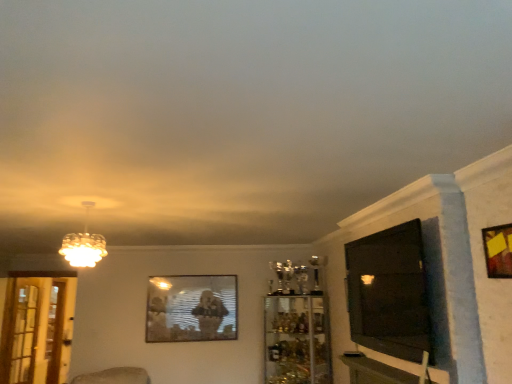
Question: Would you say wooden frame at upper right, the second picture frame in the bottom-to-top sequence, contains matte glass chandelier at upper left?

Choices:
 (A) no
 (B) yes

Answer: (A)

Question: Does wooden frame at upper right, the first picture frame from the top, touch matte glass chandelier at upper left?

Choices:
 (A) yes
 (B) no

Answer: (B)

Question: From a real-world perspective, is wooden frame at upper right, arranged as the first picture frame when viewed from the right, located higher than matte glass chandelier at upper left?

Choices:
 (A) yes
 (B) no

Answer: (B)

Question: Considering the relative sizes of wooden frame at upper right, arranged as the second picture frame when viewed from the back, and matte glass chandelier at upper left in the image provided, is wooden frame at upper right, arranged as the second picture frame when viewed from the back, thinner than matte glass chandelier at upper left?

Choices:
 (A) no
 (B) yes

Answer: (B)

Question: Can you confirm if wooden frame at upper right, which is counted as the second picture frame, starting from the left, is positioned to the left of matte glass chandelier at upper left?

Choices:
 (A) no
 (B) yes

Answer: (A)

Question: Considering the relative positions of wooden frame at upper right, the second picture frame in the bottom-to-top sequence, and matte glass chandelier at upper left in the image provided, is wooden frame at upper right, the second picture frame in the bottom-to-top sequence, behind matte glass chandelier at upper left?

Choices:
 (A) no
 (B) yes

Answer: (A)

Question: Can you confirm if wooden table at lower right is smaller than black glossy tv at right?

Choices:
 (A) no
 (B) yes

Answer: (B)

Question: Considering the relative sizes of wooden table at lower right and black glossy tv at right in the image provided, is wooden table at lower right taller than black glossy tv at right?

Choices:
 (A) yes
 (B) no

Answer: (B)

Question: Is wooden table at lower right to the left of black glossy tv at right from the viewer's perspective?

Choices:
 (A) no
 (B) yes

Answer: (B)

Question: Is wooden table at lower right bigger than black glossy tv at right?

Choices:
 (A) yes
 (B) no

Answer: (B)

Question: Does wooden table at lower right appear on the right side of black glossy tv at right?

Choices:
 (A) no
 (B) yes

Answer: (A)

Question: From the image's perspective, does wooden table at lower right appear lower than black glossy tv at right?

Choices:
 (A) yes
 (B) no

Answer: (A)

Question: Does clear glass screen door at left, which is counted as the 1th screen door, starting from the front, have a greater width compared to black glossy tv at right?

Choices:
 (A) yes
 (B) no

Answer: (B)